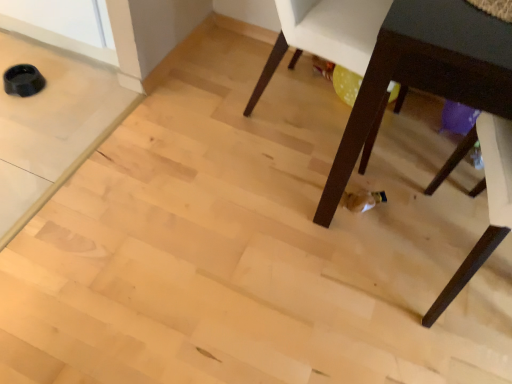
The image size is (512, 384). What are the coordinates of `vacant space that is in between white plastic chair at center, arranged as the second chair when ordered from the bottom, and dark wood table at lower right` in the screenshot? It's located at (288, 163).